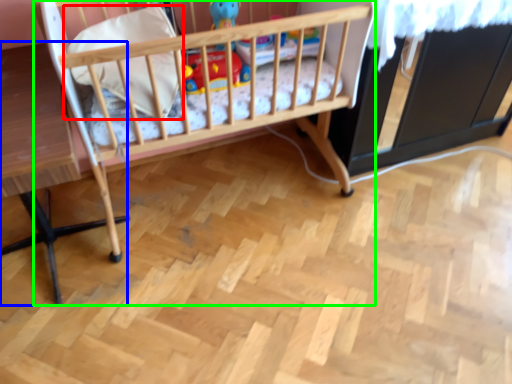
Question: Which object is positioned farthest from pillow (highlighted by a red box)? Select from table (highlighted by a blue box) and infant bed (highlighted by a green box).

Choices:
 (A) table
 (B) infant bed

Answer: (A)